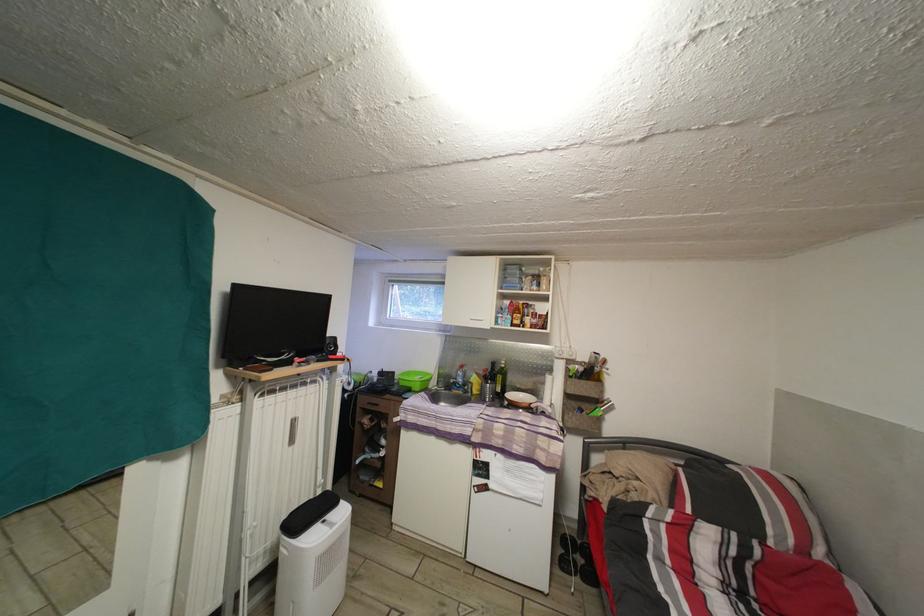
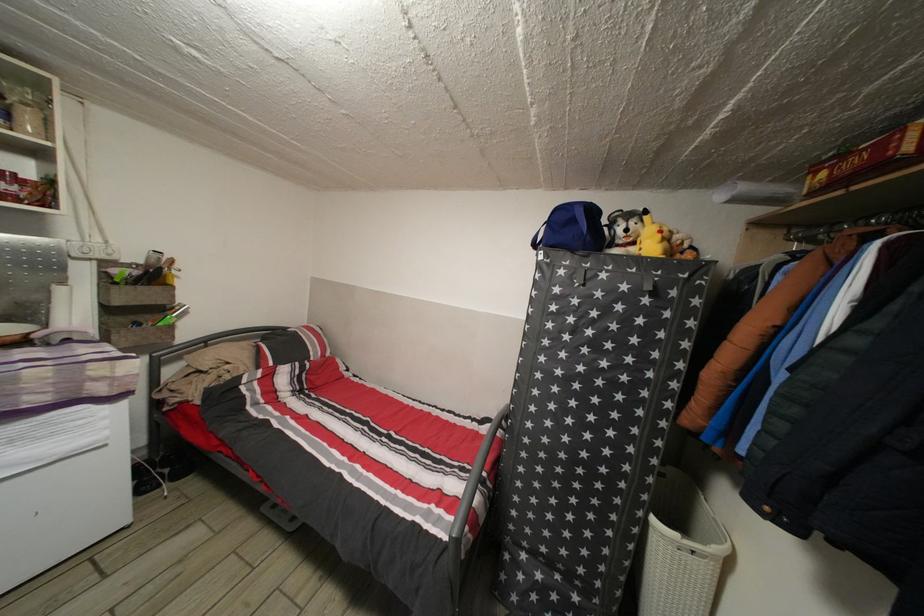
Question: The camera is either moving clockwise (left) or counter-clockwise (right) around the object. The first image is from the beginning of the video and the second image is from the end. Is the camera moving left or right when shooting the video?

Choices:
 (A) Left
 (B) Right

Answer: (A)